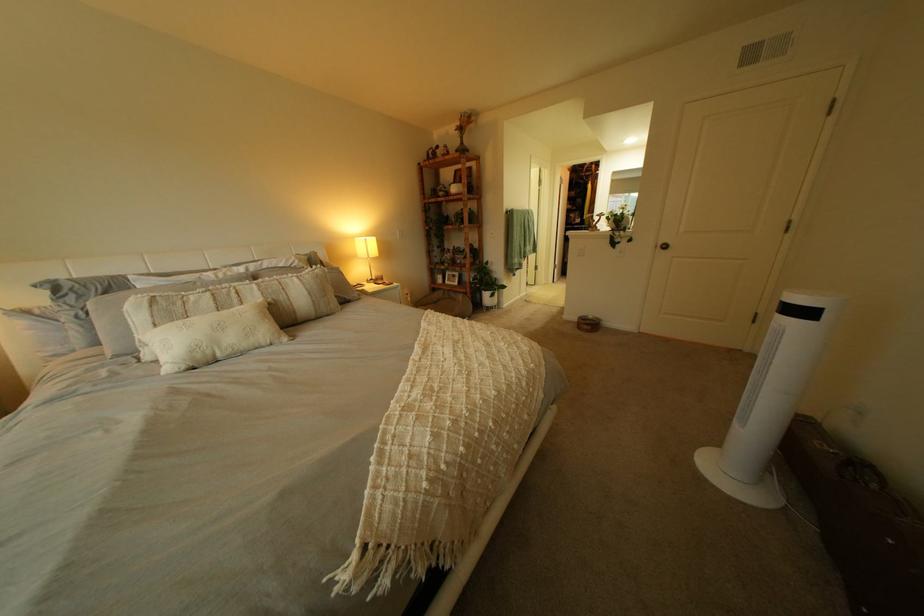
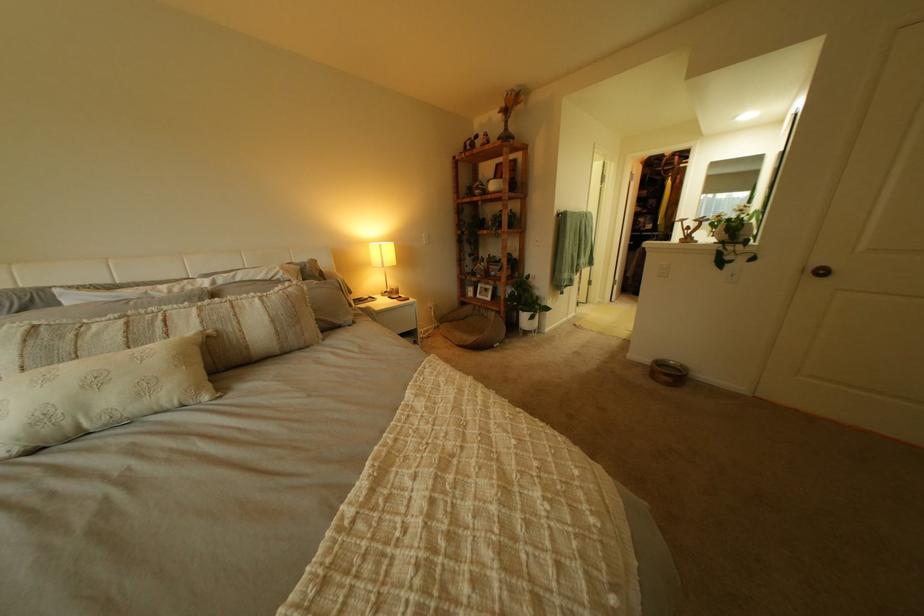
Locate, in the second image, the point that corresponds to [483,294] in the first image.

(517, 314)